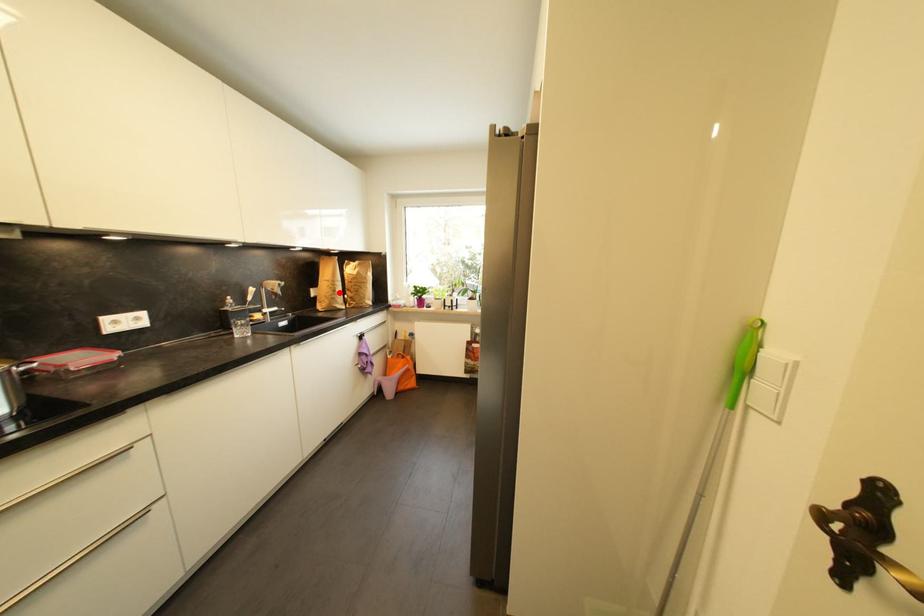
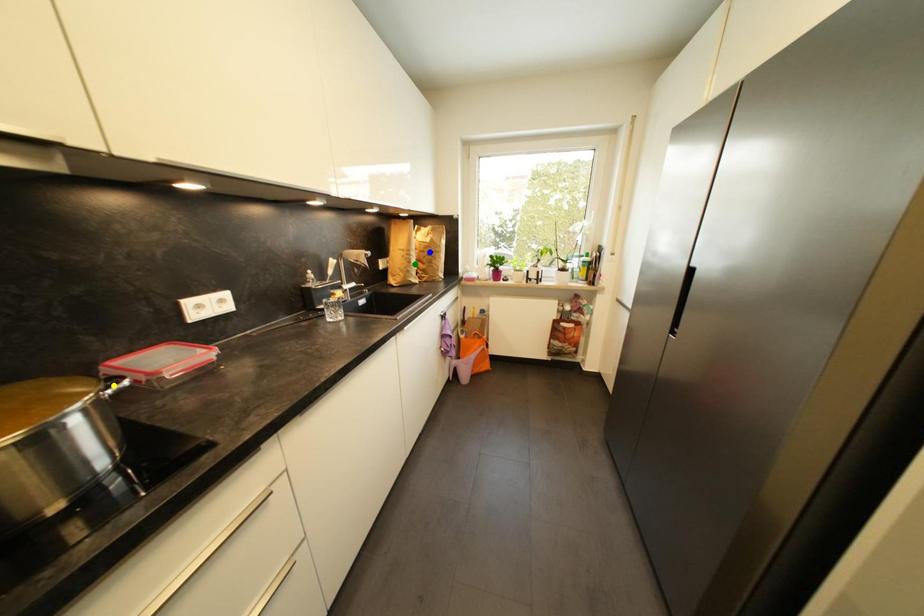
Question: I am providing you with two images of the same scene from different viewpoints. A red point is marked on the first image. You are given multiple points on the second image. Can you choose the point in image 2 that corresponds to the point in image 1?

Choices:
 (A) blue point
 (B) yellow point
 (C) green point

Answer: (C)